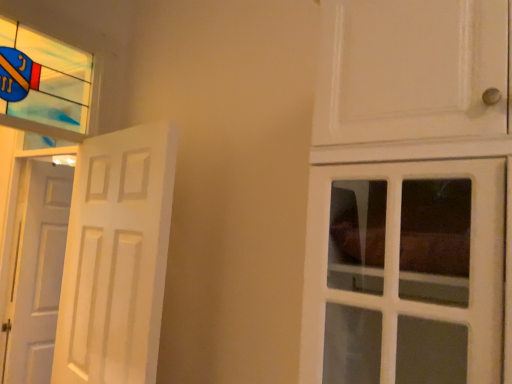
Question: Is white matte door at left, the second door viewed from the front, oriented towards white matte door at left, which is counted as the 1th door, starting from the front?

Choices:
 (A) yes
 (B) no

Answer: (B)

Question: From the image's perspective, would you say white matte door at left, arranged as the 1th door when viewed from the back, is shown under white matte door at left, which is counted as the 1th door, starting from the front?

Choices:
 (A) yes
 (B) no

Answer: (A)

Question: Is the surface of white matte door at left, arranged as the 1th door when viewed from the left, in direct contact with white matte door at left, which is counted as the 1th door, starting from the front?

Choices:
 (A) yes
 (B) no

Answer: (B)

Question: Is white matte door at left, which is counted as the 1th door, starting from the front, surrounded by white matte door at left, arranged as the 1th door when viewed from the left?

Choices:
 (A) no
 (B) yes

Answer: (A)

Question: Does white matte door at left, the second door viewed from the front, come in front of white matte door at left, which is counted as the 1th door, starting from the front?

Choices:
 (A) no
 (B) yes

Answer: (A)

Question: In terms of size, does white matte door at left, placed as the second door when sorted from left to right, appear bigger or smaller than stained glass window at upper left?

Choices:
 (A) small
 (B) big

Answer: (B)

Question: From a real-world perspective, is white matte door at left, the 1th door in the right-to-left sequence, physically located above or below stained glass window at upper left?

Choices:
 (A) above
 (B) below

Answer: (B)

Question: In terms of width, does white matte door at left, the 1th door in the right-to-left sequence, look wider or thinner when compared to stained glass window at upper left?

Choices:
 (A) thin
 (B) wide

Answer: (B)

Question: From the image's perspective, is white matte door at left, the 2th door positioned from the back, located above or below stained glass window at upper left?

Choices:
 (A) below
 (B) above

Answer: (A)

Question: In the image, is stained glass window at upper left positioned in front of or behind white matte door at left, the 1th door in the right-to-left sequence?

Choices:
 (A) front
 (B) behind

Answer: (B)

Question: From their relative heights in the image, would you say stained glass window at upper left is taller or shorter than white matte door at left, the 1th door in the right-to-left sequence?

Choices:
 (A) tall
 (B) short

Answer: (B)

Question: Is stained glass window at upper left to the left or to the right of white matte door at left, placed as the second door when sorted from left to right, in the image?

Choices:
 (A) left
 (B) right

Answer: (A)

Question: Is stained glass window at upper left spatially inside white matte door at left, placed as the second door when sorted from left to right, or outside of it?

Choices:
 (A) outside
 (B) inside

Answer: (A)

Question: In the image, is white matte door at left, the 1th door in the right-to-left sequence, positioned in front of or behind white matte door at left, arranged as the 1th door when viewed from the back?

Choices:
 (A) front
 (B) behind

Answer: (A)

Question: From the image's perspective, is white matte door at left, which is counted as the 1th door, starting from the front, above or below white matte door at left, arranged as the 1th door when viewed from the left?

Choices:
 (A) above
 (B) below

Answer: (A)